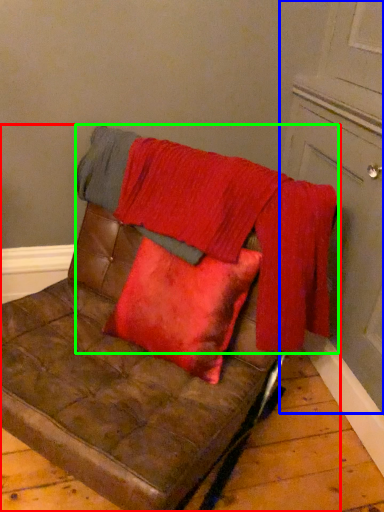
Question: Based on their relative distances, which object is nearer to furniture (highlighted by a red box)? Choose from door (highlighted by a blue box) and blanket (highlighted by a green box).

Choices:
 (A) door
 (B) blanket

Answer: (B)